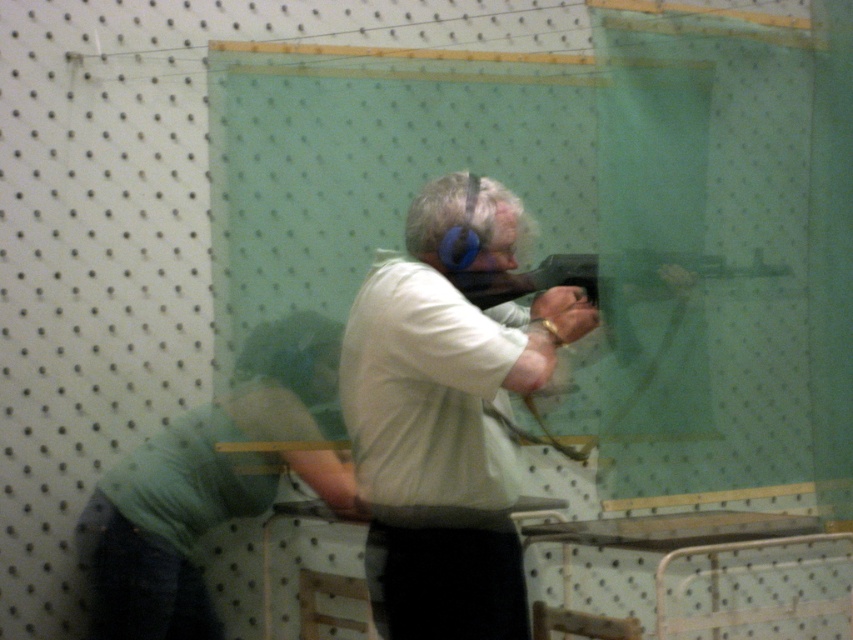
Question: Is white matte shirt at center positioned in front of light green shirt at center?

Choices:
 (A) no
 (B) yes

Answer: (B)

Question: Among these objects, which one is nearest to the camera?

Choices:
 (A) matte black gun at center
 (B) light green shirt at center

Answer: (A)

Question: Which point appears farthest from the camera in this image?

Choices:
 (A) (456, 173)
 (B) (233, 492)

Answer: (A)

Question: Which point is closer to the camera taking this photo?

Choices:
 (A) (654, 296)
 (B) (315, 480)

Answer: (A)

Question: Can you confirm if white matte shirt at center is positioned to the right of matte black gun at center?

Choices:
 (A) no
 (B) yes

Answer: (A)

Question: Is the position of light green shirt at center more distant than that of matte black gun at center?

Choices:
 (A) no
 (B) yes

Answer: (B)